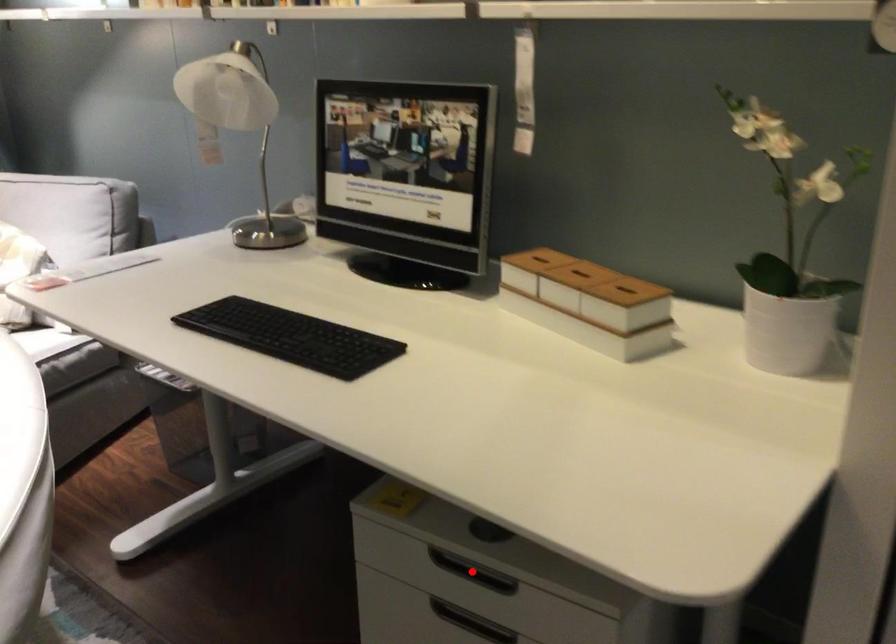
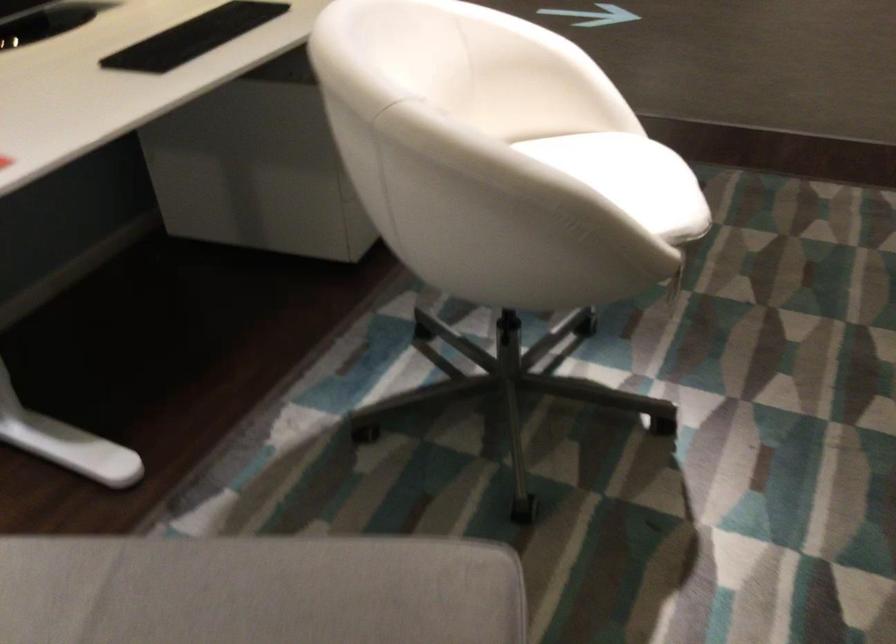
Question: I am providing you with two images of the same scene from different viewpoints. A red point is marked on the first image. Is the red point's position out of view in image 2?

Choices:
 (A) Yes
 (B) No

Answer: (A)